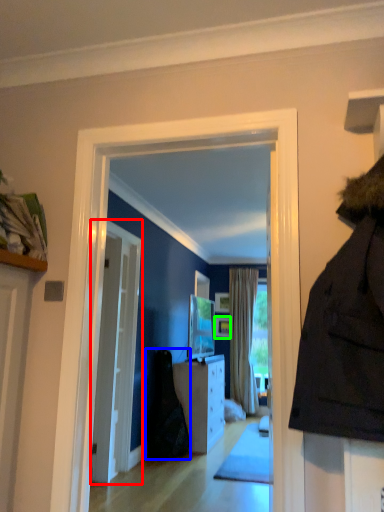
Question: Which object is the closest to the door (highlighted by a red box)? Choose among these: dark (highlighted by a blue box) or picture frame (highlighted by a green box).

Choices:
 (A) dark
 (B) picture frame

Answer: (A)